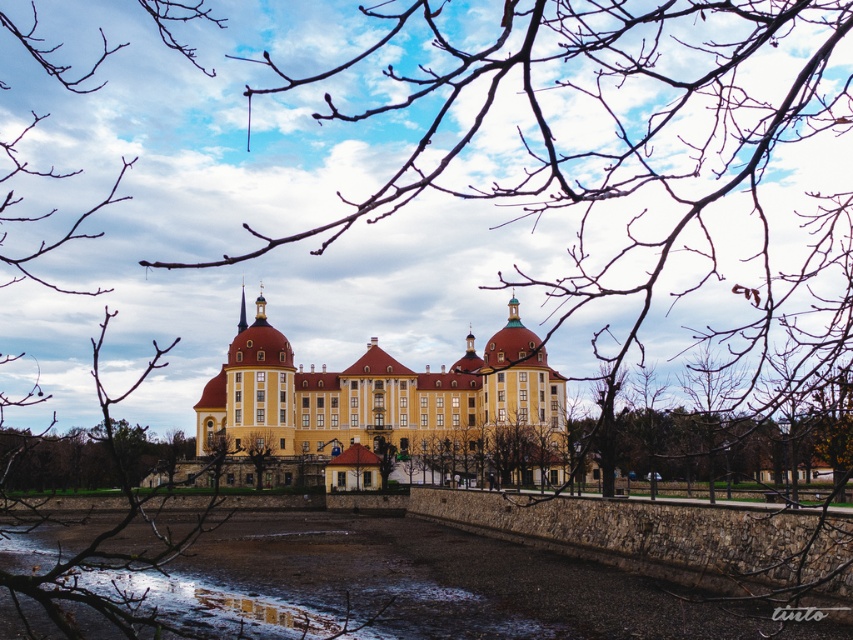
Question: Which of the following is the farthest from the observer?

Choices:
 (A) (252, 432)
 (B) (496, 392)

Answer: (B)

Question: Is yellow matte building at center thinner than green leafy tree at center?

Choices:
 (A) yes
 (B) no

Answer: (B)

Question: Which object appears closest to the camera in this image?

Choices:
 (A) glossy concrete puddle at lower center
 (B) yellow matte building at center
 (C) green leafy tree at center

Answer: (A)

Question: Considering the real-world distances, which object is closest to the yellow matte building at center?

Choices:
 (A) green leafy tree at center
 (B) glossy concrete puddle at lower center

Answer: (A)

Question: Does yellow matte building at center appear on the right side of green leafy tree at center?

Choices:
 (A) no
 (B) yes

Answer: (B)

Question: Does yellow matte building at center have a smaller size compared to green leafy tree at center?

Choices:
 (A) no
 (B) yes

Answer: (A)